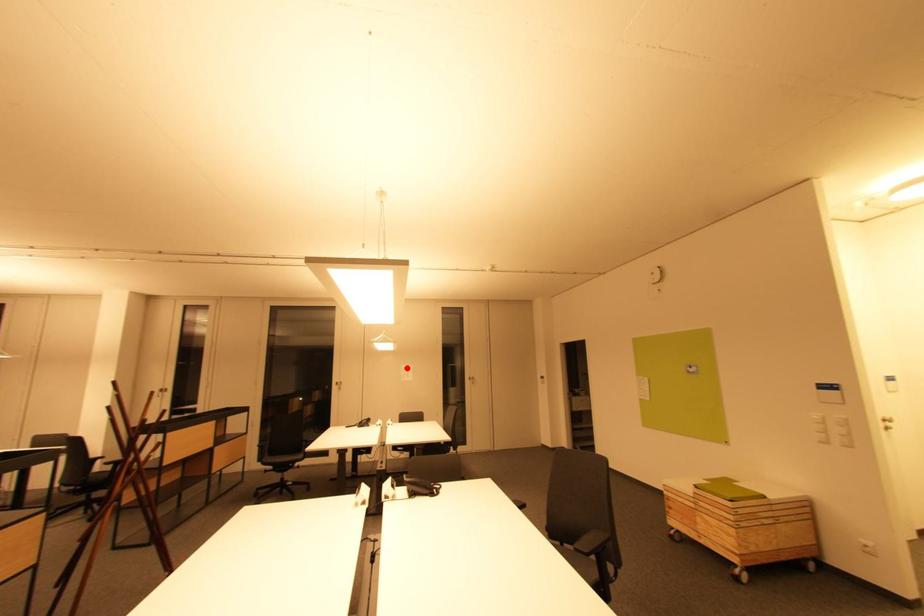
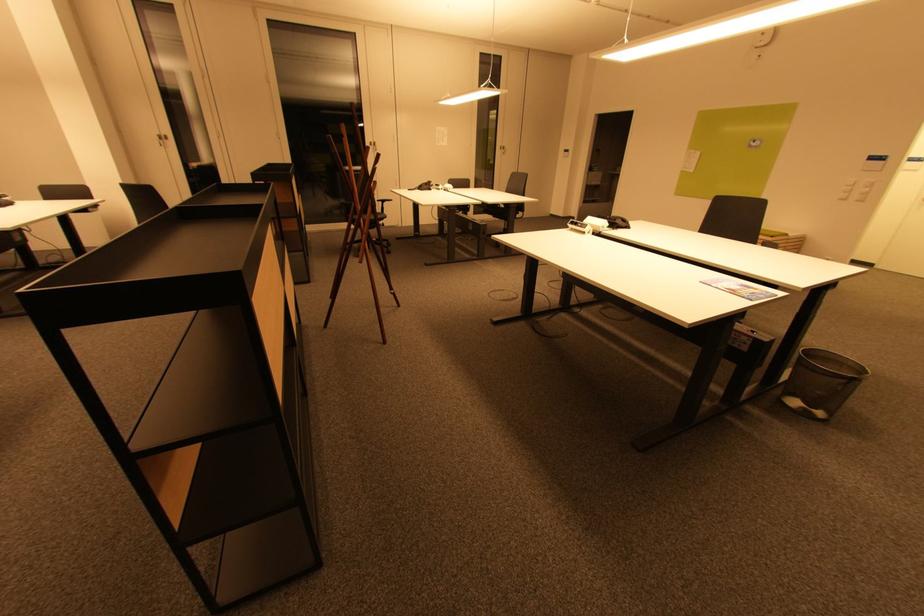
Question: I am providing you with two images of the same scene from different viewpoints. Image1 has a red point marked. In image2, the corresponding 3D location appears at what relative position? Reply with the corresponding letter.

Choices:
 (A) Closer
 (B) Farther

Answer: (A)